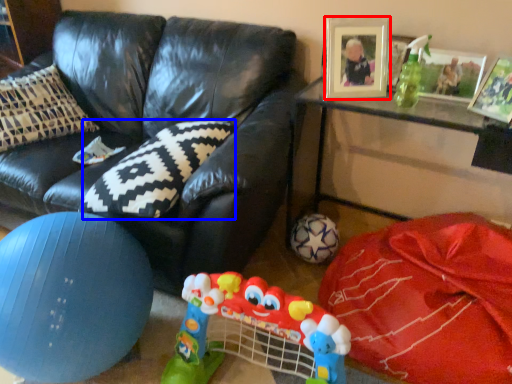
Question: Among these objects, which one is farthest to the camera, picture frame (highlighted by a red box) or pillow (highlighted by a blue box)?

Choices:
 (A) picture frame
 (B) pillow

Answer: (A)